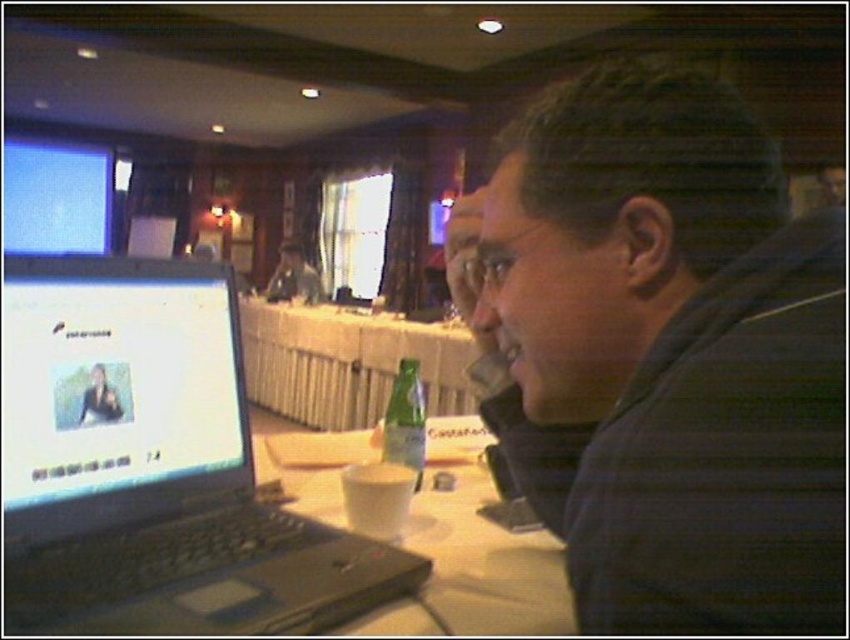
Question: Based on their relative distances, which object is farther from the dark blue striped shirt at center?

Choices:
 (A) matte screen at upper left
 (B) white wood table at center
 (C) black plastic laptop at left

Answer: (A)

Question: Can you confirm if green glass bottle at center is positioned above matte black laptop at center?

Choices:
 (A) no
 (B) yes

Answer: (A)

Question: Can you confirm if white paper at center is thinner than green glass bottle at center?

Choices:
 (A) no
 (B) yes

Answer: (A)

Question: Is black plastic laptop at left wider than green glass bottle at center?

Choices:
 (A) no
 (B) yes

Answer: (B)

Question: Which point appears farthest from the camera in this image?

Choices:
 (A) (12, 209)
 (B) (400, 433)
 (C) (26, 557)

Answer: (A)

Question: Considering the real-world distances, which object is farthest from the matte black laptop at center?

Choices:
 (A) matte screen at upper left
 (B) black plastic laptop at left
 (C) white paper at center
 (D) green glass bottle at center

Answer: (B)